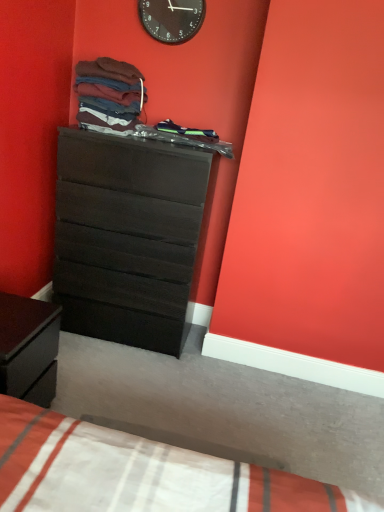
Question: Should I look upward or downward to see matte cotton shirts at upper center, the second clothing when ordered from right to left?

Choices:
 (A) down
 (B) up

Answer: (B)

Question: Is white cotton bed at lower left next to matte black dresser at center?

Choices:
 (A) no
 (B) yes

Answer: (A)

Question: Can you confirm if white cotton bed at lower left is smaller than matte black dresser at center?

Choices:
 (A) no
 (B) yes

Answer: (B)

Question: Considering the relative sizes of white cotton bed at lower left and matte black dresser at center in the image provided, is white cotton bed at lower left wider than matte black dresser at center?

Choices:
 (A) yes
 (B) no

Answer: (A)

Question: Does white cotton bed at lower left appear on the right side of matte black dresser at center?

Choices:
 (A) yes
 (B) no

Answer: (A)

Question: From a real-world perspective, is white cotton bed at lower left over matte black dresser at center?

Choices:
 (A) yes
 (B) no

Answer: (B)

Question: Is white cotton bed at lower left positioned with its back to matte black dresser at center?

Choices:
 (A) no
 (B) yes

Answer: (A)

Question: From the image's perspective, is black plastic wall clock at upper center located above matte black dresser at center?

Choices:
 (A) yes
 (B) no

Answer: (A)

Question: Does black plastic wall clock at upper center appear on the left side of matte black dresser at center?

Choices:
 (A) no
 (B) yes

Answer: (A)

Question: Does black plastic wall clock at upper center come in front of matte black dresser at center?

Choices:
 (A) no
 (B) yes

Answer: (A)

Question: Is black plastic wall clock at upper center looking in the opposite direction of matte black dresser at center?

Choices:
 (A) no
 (B) yes

Answer: (A)

Question: Can matte black dresser at center be found inside black plastic wall clock at upper center?

Choices:
 (A) no
 (B) yes

Answer: (A)

Question: Can you confirm if black plastic wall clock at upper center is thinner than matte black dresser at center?

Choices:
 (A) yes
 (B) no

Answer: (A)

Question: Is dark wood nightstand at lower left positioned in front of white cotton bed at lower left?

Choices:
 (A) yes
 (B) no

Answer: (A)